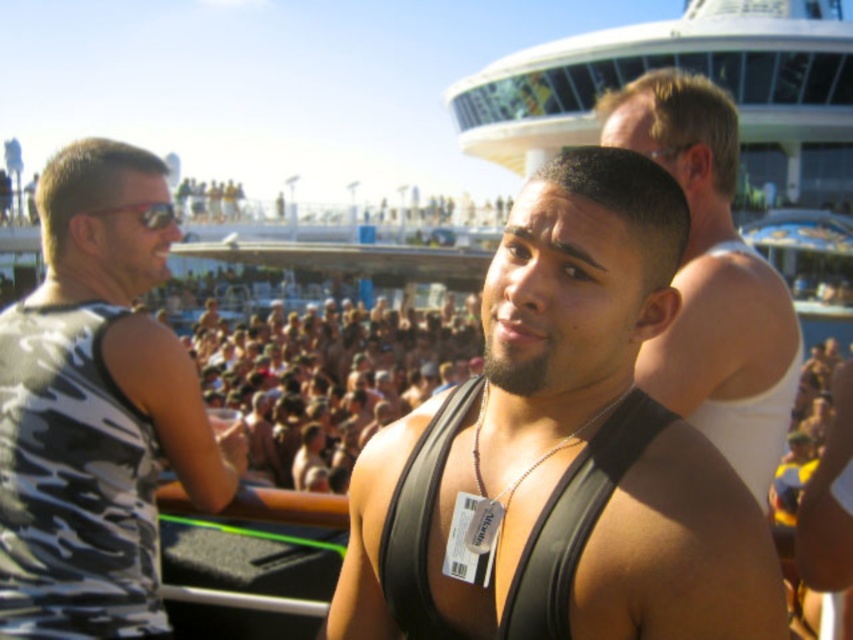
Question: Which point is closer to the camera?

Choices:
 (A) (537, 547)
 (B) (514, 285)
 (C) (701, 349)
 (D) (137, 211)

Answer: (A)

Question: Based on their relative distances, which object is farther from the camouflage tank top at left?

Choices:
 (A) black leather vest at center
 (B) black fabric tank top at right
 (C) black matte vest at center

Answer: (B)

Question: From the image, what is the correct spatial relationship of black fabric tank top at right in relation to black leather vest at center?

Choices:
 (A) above
 (B) below

Answer: (A)

Question: Can you confirm if black matte vest at center is positioned above black fabric tank top at right?

Choices:
 (A) no
 (B) yes

Answer: (A)

Question: In this image, where is black fabric tank top at right located relative to red reflective sunglasses at left?

Choices:
 (A) right
 (B) left

Answer: (A)

Question: Which of the following is the closest to the observer?

Choices:
 (A) (537, 522)
 (B) (733, 182)

Answer: (A)